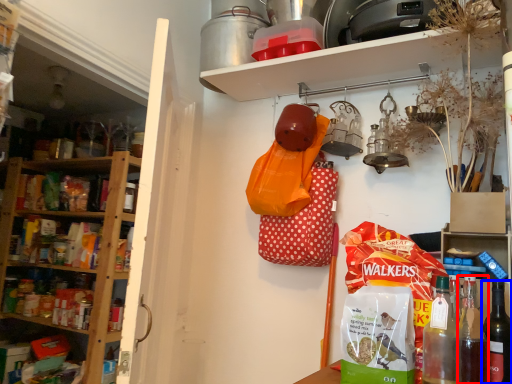
Question: Which of the following is the closest to the observer, bottle (highlighted by a red box) or bottle (highlighted by a blue box)?

Choices:
 (A) bottle
 (B) bottle

Answer: (A)